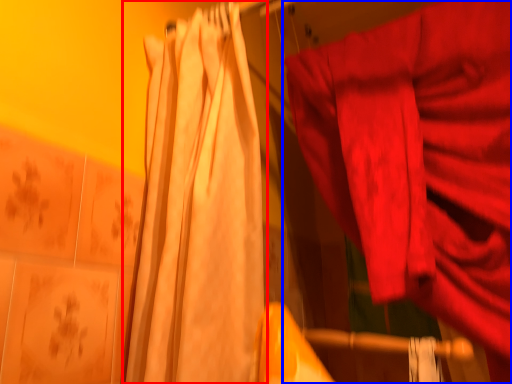
Question: Which object is closer to the camera taking this photo, curtain (highlighted by a red box) or curtain (highlighted by a blue box)?

Choices:
 (A) curtain
 (B) curtain

Answer: (A)